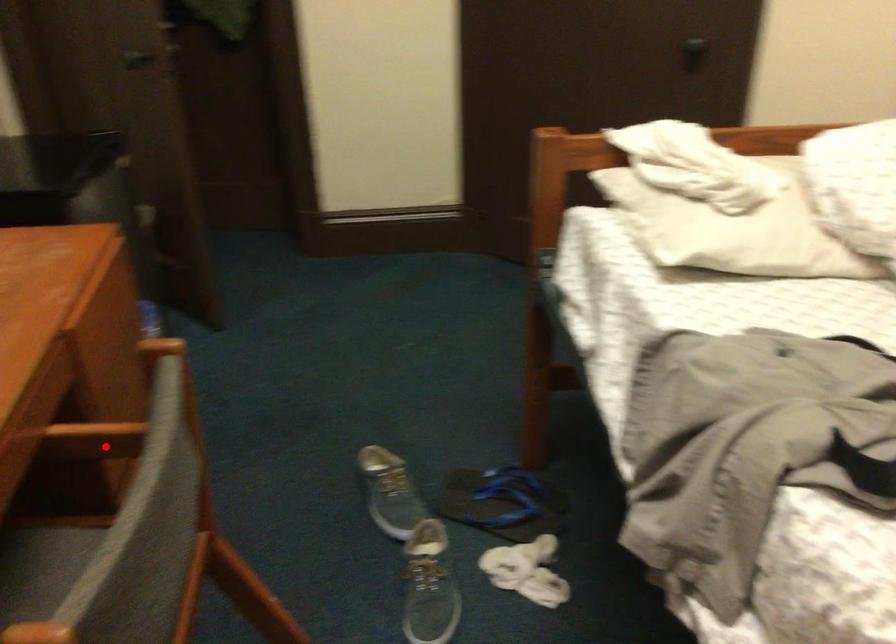
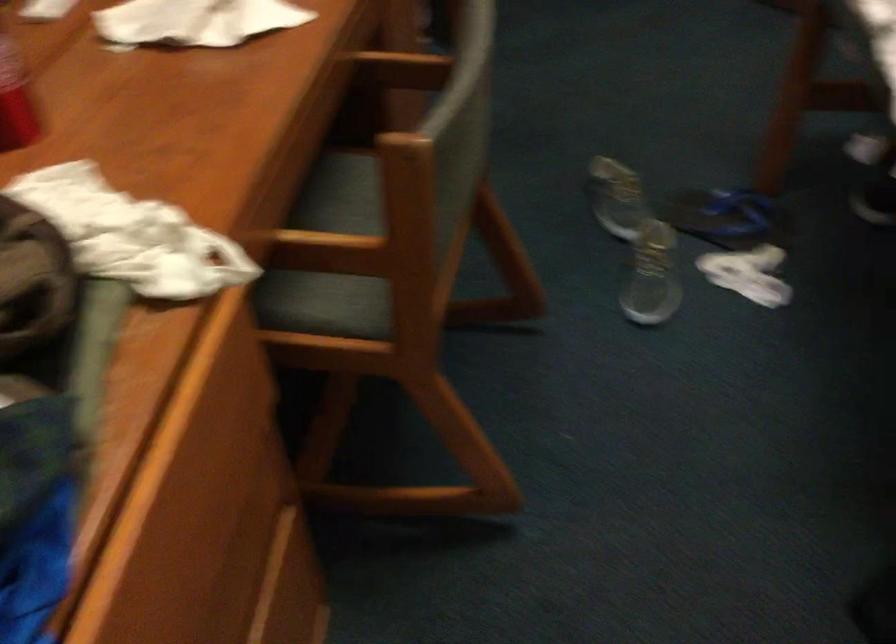
Question: I am providing you with two images of the same scene from different viewpoints. A red point is marked on the first image. At the location where the point appears in image 1, is it still visible in image 2?

Choices:
 (A) Yes
 (B) No

Answer: (A)